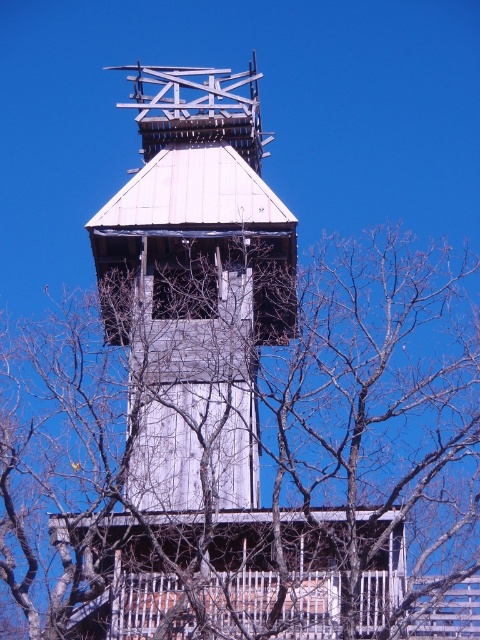
Question: Can you confirm if bare branches at center is thinner than white wooden tower at center?

Choices:
 (A) yes
 (B) no

Answer: (B)

Question: Which object is closer to the camera taking this photo?

Choices:
 (A) bare branches at center
 (B) white wooden tower at center

Answer: (A)

Question: Observing the image, what is the correct spatial positioning of bare branches at center in reference to white wooden tower at center?

Choices:
 (A) above
 (B) below

Answer: (B)

Question: Does bare branches at center come in front of white wooden tower at center?

Choices:
 (A) yes
 (B) no

Answer: (A)